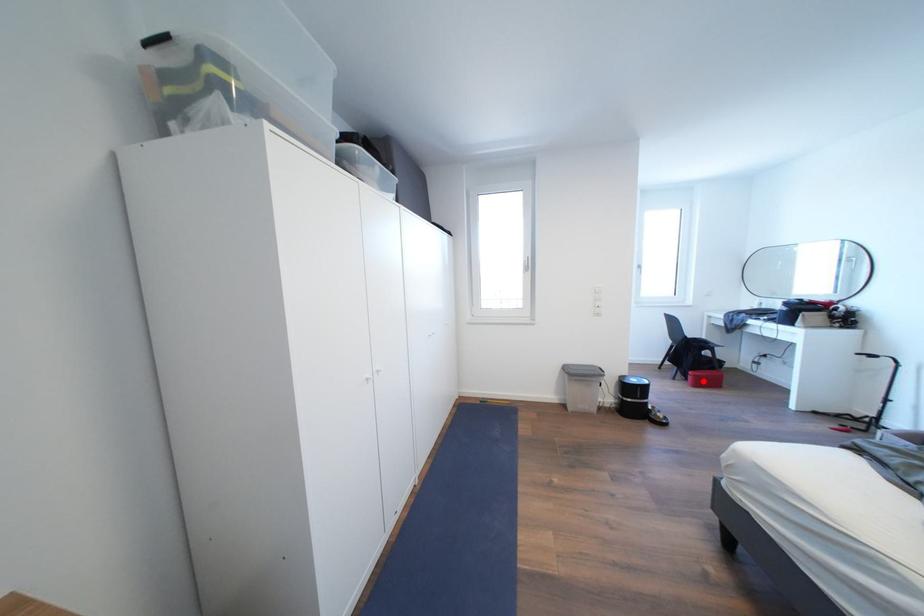
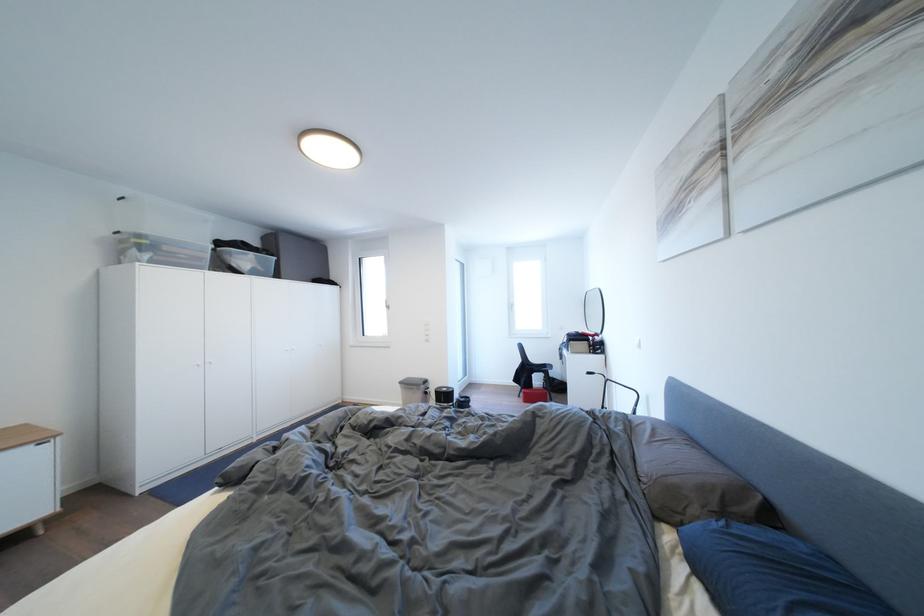
In the second image, find the point that corresponds to the highlighted location in the first image.

(532, 398)